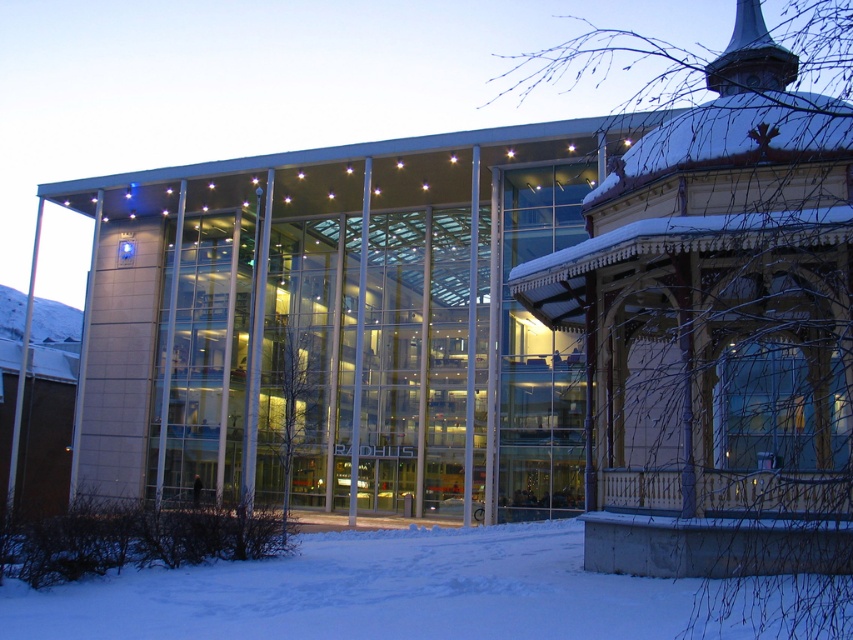
Question: Is wooden gazebo at right to the left of white powdery snow at lower left from the viewer's perspective?

Choices:
 (A) no
 (B) yes

Answer: (A)

Question: Among these points, which one is nearest to the camera?

Choices:
 (A) (773, 236)
 (B) (318, 536)

Answer: (A)

Question: Does wooden gazebo at right have a larger size compared to white powdery snow at lower left?

Choices:
 (A) yes
 (B) no

Answer: (A)

Question: Where is wooden gazebo at right located in relation to white powdery snow at lower left in the image?

Choices:
 (A) left
 (B) right

Answer: (B)

Question: Which of the following is the farthest from the observer?

Choices:
 (A) (631, 272)
 (B) (468, 547)

Answer: (B)

Question: Which of the following is the closest to the observer?

Choices:
 (A) (814, 100)
 (B) (45, 589)

Answer: (B)